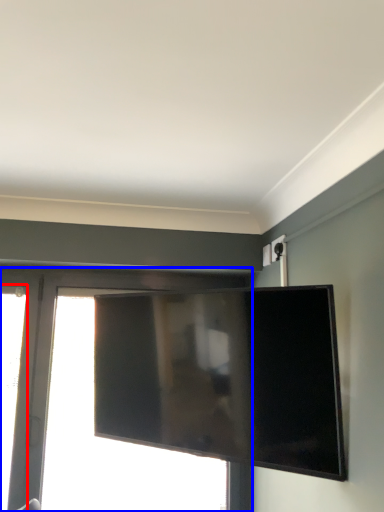
Question: Among these objects, which one is farthest to the camera, window (highlighted by a red box) or window (highlighted by a blue box)?

Choices:
 (A) window
 (B) window

Answer: (B)